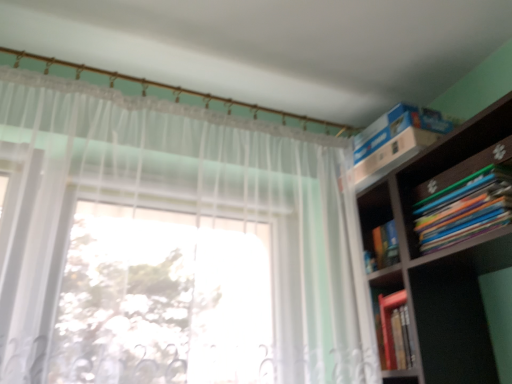
This screenshot has width=512, height=384. Find the location of `multicolored paperbacks at upper right`. multicolored paperbacks at upper right is located at coordinates (465, 209).

What do you see at coordinates (465, 209) in the screenshot?
I see `multicolored paperbacks at upper right` at bounding box center [465, 209].

Where is `white sheer curtain at upper left`? white sheer curtain at upper left is located at coordinates (181, 212).

Describe the element at coordinates (181, 212) in the screenshot. The image size is (512, 384). I see `white sheer curtain at upper left` at that location.

Locate an element on the screen. multicolored paperbacks at upper right is located at coordinates (465, 209).

Looking at this image, considering the relative positions of white sheer curtain at upper left and multicolored paperbacks at upper right in the image provided, is white sheer curtain at upper left to the left of multicolored paperbacks at upper right from the viewer's perspective?

Correct, you'll find white sheer curtain at upper left to the left of multicolored paperbacks at upper right.

Is white sheer curtain at upper left behind multicolored paperbacks at upper right?

No, it is not.

Does point (170, 139) come behind point (436, 193)?

Yes.

From the image's perspective, which one is positioned higher, white sheer curtain at upper left or multicolored paperbacks at upper right?

From the image's view, multicolored paperbacks at upper right is above.

From a real-world perspective, is white sheer curtain at upper left on top of multicolored paperbacks at upper right?

No, from a real-world perspective, white sheer curtain at upper left is not on top of multicolored paperbacks at upper right.

Which object is wider, white sheer curtain at upper left or multicolored paperbacks at upper right?

multicolored paperbacks at upper right is wider.

Does white sheer curtain at upper left have a greater height compared to multicolored paperbacks at upper right?

Yes, white sheer curtain at upper left is taller than multicolored paperbacks at upper right.

Looking at this image, in terms of size, does white sheer curtain at upper left appear bigger or smaller than multicolored paperbacks at upper right?

Clearly, white sheer curtain at upper left is larger in size than multicolored paperbacks at upper right.

Is white sheer curtain at upper left spatially inside multicolored paperbacks at upper right, or outside of it?

white sheer curtain at upper left is spatially situated outside multicolored paperbacks at upper right.

Can you see white sheer curtain at upper left touching multicolored paperbacks at upper right?

white sheer curtain at upper left and multicolored paperbacks at upper right are not in contact.

Is white sheer curtain at upper left turned away from multicolored paperbacks at upper right?

No, multicolored paperbacks at upper right is not at the back of white sheer curtain at upper left.

How far apart are white sheer curtain at upper left and multicolored paperbacks at upper right?

white sheer curtain at upper left is 21.24 inches from multicolored paperbacks at upper right.

You are a GUI agent. You are given a task and a screenshot of the screen. Output one action in this format:
    pyautogui.click(x=<x>, y=<y>)
    Task: Click on the book on the right of white sheer curtain at upper left
    This screenshot has width=512, height=384.
    Given the screenshot: What is the action you would take?
    (465, 209)

Is multicolored paperbacks at upper right at the left side of white sheer curtain at upper left?

Incorrect, multicolored paperbacks at upper right is not on the left side of white sheer curtain at upper left.

Considering their positions, is multicolored paperbacks at upper right located in front of or behind white sheer curtain at upper left?

Clearly, multicolored paperbacks at upper right is behind white sheer curtain at upper left.

Considering the points (438, 197) and (231, 170), which point is behind, point (438, 197) or point (231, 170)?

The point (231, 170) is more distant.

From the image's perspective, relative to white sheer curtain at upper left, is multicolored paperbacks at upper right above or below?

Clearly, from the image's perspective, multicolored paperbacks at upper right is above white sheer curtain at upper left.

Based on the photo, from a real-world perspective, is multicolored paperbacks at upper right under white sheer curtain at upper left?

Actually, multicolored paperbacks at upper right is physically above white sheer curtain at upper left in the real world.

Between multicolored paperbacks at upper right and white sheer curtain at upper left, which one has larger width?

With larger width is multicolored paperbacks at upper right.

Which of these two, multicolored paperbacks at upper right or white sheer curtain at upper left, stands taller?

white sheer curtain at upper left.

Can you confirm if multicolored paperbacks at upper right is bigger than white sheer curtain at upper left?

Actually, multicolored paperbacks at upper right might be smaller than white sheer curtain at upper left.

Do you think multicolored paperbacks at upper right is within white sheer curtain at upper left, or outside of it?

The correct answer is: outside.

Is multicolored paperbacks at upper right not close to white sheer curtain at upper left?

No, multicolored paperbacks at upper right is not far away from white sheer curtain at upper left.

Is multicolored paperbacks at upper right facing towards white sheer curtain at upper left?

Yes, multicolored paperbacks at upper right is oriented towards white sheer curtain at upper left.

How different are the orientations of multicolored paperbacks at upper right and white sheer curtain at upper left in degrees?

The angle between the facing direction of multicolored paperbacks at upper right and the facing direction of white sheer curtain at upper left is 90.3 degrees.

How much distance is there between multicolored paperbacks at upper right and white sheer curtain at upper left?

A distance of 21.24 inches exists between multicolored paperbacks at upper right and white sheer curtain at upper left.

You are a GUI agent. You are given a task and a screenshot of the screen. Output one action in this format:
    pyautogui.click(x=<x>, y=<y>)
    Task: Click on the curtain that is below the multicolored paperbacks at upper right (from the image's perspective)
    The height and width of the screenshot is (384, 512).
    Given the screenshot: What is the action you would take?
    pyautogui.click(x=181, y=212)

Where is `curtain below the multicolored paperbacks at upper right (from a real-world perspective)`? curtain below the multicolored paperbacks at upper right (from a real-world perspective) is located at coordinates (181, 212).

Where is `curtain on the left side of multicolored paperbacks at upper right`? The image size is (512, 384). curtain on the left side of multicolored paperbacks at upper right is located at coordinates (181, 212).